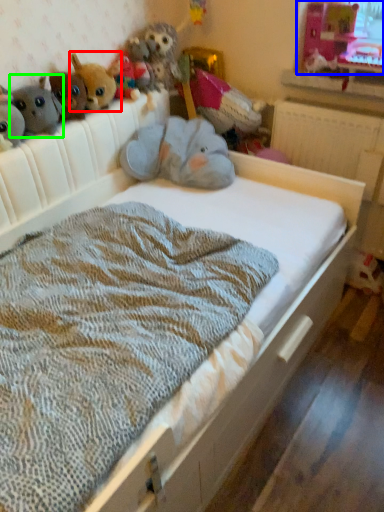
Question: Considering the real-world distances, which object is farthest from toy (highlighted by a red box)? window screen (highlighted by a blue box) or toy (highlighted by a green box)?

Choices:
 (A) window screen
 (B) toy

Answer: (A)